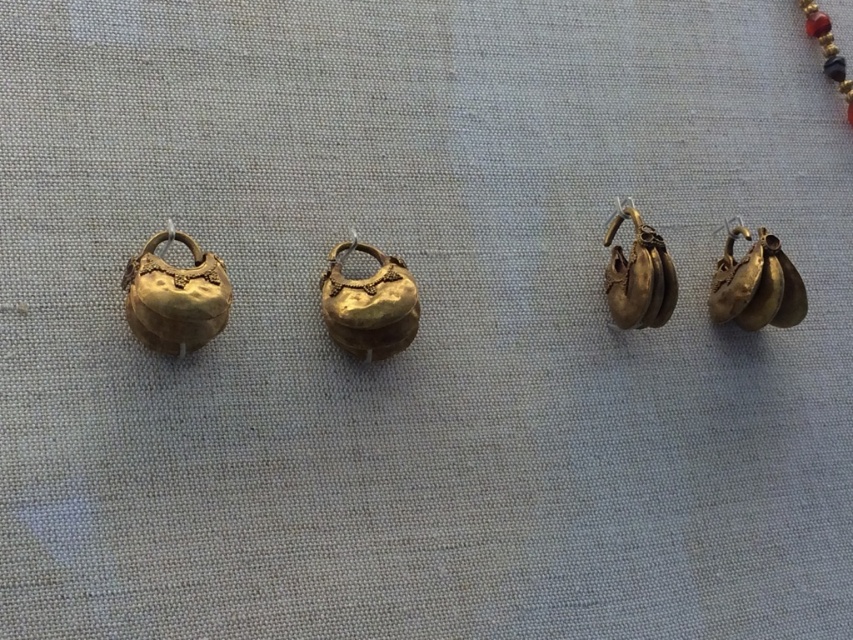
Which is below, gold shiny earrings at right or gold beaded necklace at upper right?

gold shiny earrings at right is below.

Measure the distance from gold shiny earrings at right to gold beaded necklace at upper right.

They are 8.34 inches apart.

Between point (769, 292) and point (846, 83), which one is positioned behind?

Positioned behind is point (846, 83).

Locate an element on the screen. gold shiny earrings at right is located at coordinates (756, 284).

Is gold shiny bell at center taller than gold beaded necklace at upper right?

No, gold shiny bell at center is not taller than gold beaded necklace at upper right.

Where is `gold shiny bell at center`? This screenshot has width=853, height=640. gold shiny bell at center is located at coordinates (369, 305).

The width and height of the screenshot is (853, 640). Find the location of `gold shiny bell at center`. gold shiny bell at center is located at coordinates (369, 305).

Based on the photo, can you confirm if gold shiny bell at center is positioned to the right of gold/yellow metal/earrings at right?

In fact, gold shiny bell at center is to the left of gold/yellow metal/earrings at right.

The height and width of the screenshot is (640, 853). What are the coordinates of `gold shiny bell at center` in the screenshot? It's located at (369, 305).

Where is `gold shiny bell at center`? This screenshot has height=640, width=853. gold shiny bell at center is located at coordinates (369, 305).

Locate an element on the screen. The image size is (853, 640). gold shiny bell at center is located at coordinates [x=369, y=305].